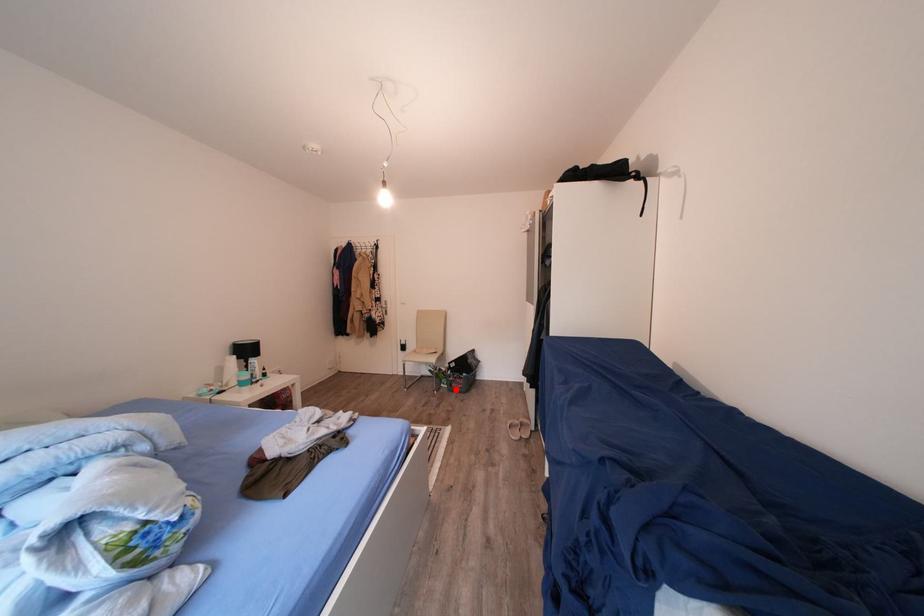
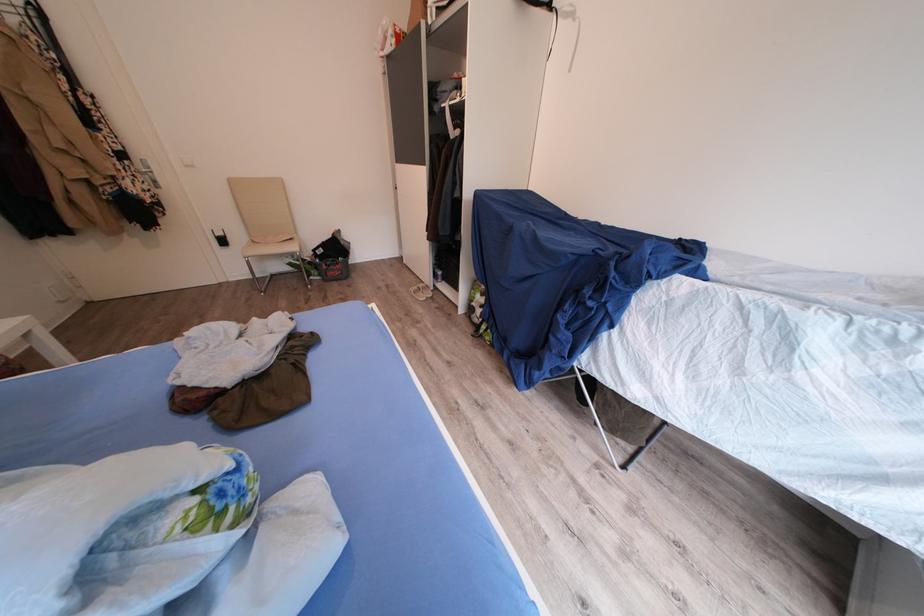
In the second image, find the point that corresponds to the highlighted location in the first image.

(329, 281)